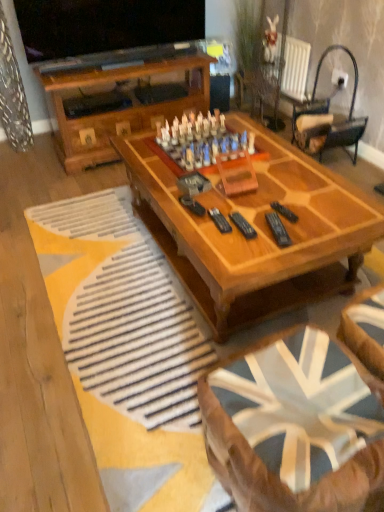
In order to face wooden coffee table at center, which is counted as the 1th coffee table, starting from the back, should I rotate leftwards or rightwards?

You should look right and rotate roughly 5.343 degrees.

Where is `wooden coffee table at center, the 1th coffee table from the top`? This screenshot has height=512, width=384. wooden coffee table at center, the 1th coffee table from the top is located at coordinates (259, 218).

What is the approximate height of black plastic remote at center, marked as the 1th remote in a left-to-right arrangement?

black plastic remote at center, marked as the 1th remote in a left-to-right arrangement, is 1.05 inches tall.

The height and width of the screenshot is (512, 384). What do you see at coordinates (278, 229) in the screenshot?
I see `black plastic remote at center, arranged as the second remote when viewed from the right` at bounding box center [278, 229].

You are a GUI agent. You are given a task and a screenshot of the screen. Output one action in this format:
    pyautogui.click(x=<x>, y=<y>)
    Task: Click on the black plastic remote at center, which is the 2th remote in left-to-right order
    
    Given the screenshot: What is the action you would take?
    pyautogui.click(x=278, y=229)

What are the coordinates of `wooden coffee table at center, which is counted as the second coffee table, starting from the back` in the screenshot? It's located at (278, 477).

Where is `wooden coffee table at center, the 1th coffee table from the top`? The height and width of the screenshot is (512, 384). wooden coffee table at center, the 1th coffee table from the top is located at coordinates (259, 218).

Considering the sizes of objects black plastic remote at center, which appears as the third remote when viewed from the right, and wooden coffee table at center, placed as the 2th coffee table when sorted from top to bottom, in the image provided, who is taller, black plastic remote at center, which appears as the third remote when viewed from the right, or wooden coffee table at center, placed as the 2th coffee table when sorted from top to bottom,?

With more height is wooden coffee table at center, placed as the 2th coffee table when sorted from top to bottom.

Is point (248, 236) in front of point (368, 345)?

That is False.

Between black plastic remote at center, which appears as the third remote when viewed from the right, and wooden coffee table at center, which is the first coffee table from front to back, which one has smaller width?

Thinner between the two is black plastic remote at center, which appears as the third remote when viewed from the right.

Measure the distance between black plastic remote at center, which appears as the third remote when viewed from the right, and wooden coffee table at center, which is the first coffee table from front to back.

The distance of black plastic remote at center, which appears as the third remote when viewed from the right, from wooden coffee table at center, which is the first coffee table from front to back, is 30.80 inches.

Can you tell me how much black plastic remote at center, positioned as the first remote in right-to-left order, and black metal/wooden rocking chair at upper right differ in facing direction?

85.9 degrees separate the facing orientations of black plastic remote at center, positioned as the first remote in right-to-left order, and black metal/wooden rocking chair at upper right.

Between black plastic remote at center, positioned as the first remote in right-to-left order, and black metal/wooden rocking chair at upper right, which one has larger width?

black metal/wooden rocking chair at upper right.

From a real-world perspective, which is physically below, black plastic remote at center, positioned as the first remote in right-to-left order, or black metal/wooden rocking chair at upper right?

black metal/wooden rocking chair at upper right is physically lower.

Does black plastic remote at center, positioned as the first remote in right-to-left order, have a greater height compared to black metal/wooden rocking chair at upper right?

In fact, black plastic remote at center, positioned as the first remote in right-to-left order, may be shorter than black metal/wooden rocking chair at upper right.

Consider the image. In the image, is black plastic remote at center, marked as the 1th remote in a left-to-right arrangement, on the left side or the right side of wooden chess set at center?

black plastic remote at center, marked as the 1th remote in a left-to-right arrangement, is positioned on wooden chess set at center's right side.

Considering the positions of objects black plastic remote at center, which appears as the third remote when viewed from the right, and wooden chess set at center in the image provided, who is in front, black plastic remote at center, which appears as the third remote when viewed from the right, or wooden chess set at center?

Positioned in front is black plastic remote at center, which appears as the third remote when viewed from the right.

Are black plastic remote at center, which appears as the third remote when viewed from the right, and wooden chess set at center far apart?

Actually, black plastic remote at center, which appears as the third remote when viewed from the right, and wooden chess set at center are a little close together.

Is black plastic remote at center, positioned as the first remote in right-to-left order, further to camera compared to wooden coffee table at center, which appears as the 2th coffee table when viewed from the front?

Yes, the depth of black plastic remote at center, positioned as the first remote in right-to-left order, is greater than that of wooden coffee table at center, which appears as the 2th coffee table when viewed from the front.

In terms of height, does black plastic remote at center, positioned as the first remote in right-to-left order, look taller or shorter compared to wooden coffee table at center, the 1th coffee table from the top?

In the image, black plastic remote at center, positioned as the first remote in right-to-left order, appears to be shorter than wooden coffee table at center, the 1th coffee table from the top.

Can you see black plastic remote at center, the 3th remote viewed from the left, touching wooden coffee table at center, which is counted as the 1th coffee table, starting from the back?

They are not placed beside each other.

Can you confirm if black plastic remote at center, the 3th remote viewed from the left, is bigger than wooden coffee table at center, the 1th coffee table from the top?

No, black plastic remote at center, the 3th remote viewed from the left, is not bigger than wooden coffee table at center, the 1th coffee table from the top.

Could you tell me if black plastic remote at center, marked as the 1th remote in a left-to-right arrangement, is facing black metal/wooden rocking chair at upper right?

No.

Is black plastic remote at center, which appears as the third remote when viewed from the right, in front of or behind black metal/wooden rocking chair at upper right in the image?

Visually, black plastic remote at center, which appears as the third remote when viewed from the right, is located in front of black metal/wooden rocking chair at upper right.

Can you tell me how much black plastic remote at center, which appears as the third remote when viewed from the right, and black metal/wooden rocking chair at upper right differ in facing direction?

93.6 degrees.

Between black plastic remote at center, which appears as the third remote when viewed from the right, and black metal/wooden rocking chair at upper right, which one appears on the right side from the viewer's perspective?

black metal/wooden rocking chair at upper right is more to the right.

Considering the points (282, 241) and (361, 454), which point is in front, point (282, 241) or point (361, 454)?

Point (361, 454)

From a real-world perspective, relative to wooden coffee table at center, placed as the 2th coffee table when sorted from top to bottom, is black plastic remote at center, arranged as the second remote when viewed from the right, vertically above or below?

In terms of real-world spatial position, black plastic remote at center, arranged as the second remote when viewed from the right, is above wooden coffee table at center, placed as the 2th coffee table when sorted from top to bottom.

Does black plastic remote at center, which is the 2th remote in left-to-right order, lie behind wooden coffee table at center, placed as the 2th coffee table when sorted from top to bottom?

Yes, black plastic remote at center, which is the 2th remote in left-to-right order, is further from the viewer.

From the image's perspective, count 1st remotes downward from the black plastic remote at center, the 3th remote viewed from the left, and point to it. Please provide its 2D coordinates.

[(243, 225)]

Between black plastic remote at center, which appears as the third remote when viewed from the right, and black plastic remote at center, the 3th remote viewed from the left, which one has more height?

black plastic remote at center, which appears as the third remote when viewed from the right, is taller.

Is black plastic remote at center, which appears as the third remote when viewed from the right, with black plastic remote at center, the 3th remote viewed from the left?

There is a gap between black plastic remote at center, which appears as the third remote when viewed from the right, and black plastic remote at center, the 3th remote viewed from the left.

Is black plastic remote at center, marked as the 1th remote in a left-to-right arrangement, smaller than black plastic remote at center, the 3th remote viewed from the left?

Actually, black plastic remote at center, marked as the 1th remote in a left-to-right arrangement, might be larger than black plastic remote at center, the 3th remote viewed from the left.

Find the location of `the 2nd remote above when counting from the wooden coffee table at center, which is counted as the second coffee table, starting from the back (from the image's perspective)`. the 2nd remote above when counting from the wooden coffee table at center, which is counted as the second coffee table, starting from the back (from the image's perspective) is located at coordinates (243, 225).

The height and width of the screenshot is (512, 384). I want to click on rocking chair below the black plastic remote at center, the 3th remote viewed from the left (from a real-world perspective), so click(327, 119).

Considering their positions, is black plastic remote at center, which appears as the third remote when viewed from the right, positioned closer to black metal/wooden rocking chair at upper right than wooden chess set at center?

wooden chess set at center is closer to black metal/wooden rocking chair at upper right.

From the image, which object appears to be nearer to wooden coffee table at center, placed as the 2th coffee table when sorted from top to bottom, black plastic remote at center, arranged as the second remote when viewed from the right, or wooden chess set at center?

The object closer to wooden coffee table at center, placed as the 2th coffee table when sorted from top to bottom, is black plastic remote at center, arranged as the second remote when viewed from the right.

Based on their spatial positions, is wooden coffee table at center, placed as the 2th coffee table when sorted from top to bottom, or black plastic remote at center, positioned as the first remote in right-to-left order, closer to wooden chess set at center?

black plastic remote at center, positioned as the first remote in right-to-left order, lies closer to wooden chess set at center than the other object.

Estimate the real-world distances between objects in this image. Which object is further from wooden coffee table at center, arranged as the 2th coffee table when ordered from the bottom, black metal/wooden rocking chair at upper right or black plastic remote at center, arranged as the second remote when viewed from the right?

Among the two, black metal/wooden rocking chair at upper right is located further to wooden coffee table at center, arranged as the 2th coffee table when ordered from the bottom.

Estimate the real-world distances between objects in this image. Which object is further from wooden chess set at center, black plastic remote at center, which is the 2th remote in left-to-right order, or black plastic remote at center, the 3th remote viewed from the left?

black plastic remote at center, which is the 2th remote in left-to-right order.

Which object lies nearer to the anchor point wooden coffee table at center, the 1th coffee table from the top, wooden coffee table at center, which is counted as the second coffee table, starting from the back, or black plastic remote at center, marked as the 1th remote in a left-to-right arrangement?

black plastic remote at center, marked as the 1th remote in a left-to-right arrangement.

Estimate the real-world distances between objects in this image. Which object is closer to wooden chess set at center, black plastic remote at center, which appears as the third remote when viewed from the right, or black plastic remote at center, arranged as the second remote when viewed from the right?

The object closer to wooden chess set at center is black plastic remote at center, which appears as the third remote when viewed from the right.

Which object lies further to the anchor point wooden chess set at center, black plastic remote at center, marked as the 1th remote in a left-to-right arrangement, or black metal/wooden rocking chair at upper right?

black metal/wooden rocking chair at upper right.

Find the location of a particular element. remote between black metal/wooden rocking chair at upper right and black plastic remote at center, which appears as the third remote when viewed from the right, from top to bottom is located at coordinates (284, 212).

The height and width of the screenshot is (512, 384). In order to click on remote positioned between wooden coffee table at center, arranged as the 2th coffee table when ordered from the bottom, and black plastic remote at center, which appears as the third remote when viewed from the right, from near to far in this screenshot , I will do pos(278,229).

Identify the location of coffee table between wooden chess set at center and wooden coffee table at center, which is the first coffee table from front to back, in the vertical direction. (259, 218).

Find the location of a particular element. The image size is (384, 512). game located between wooden coffee table at center, the 1th coffee table from the top, and black metal/wooden rocking chair at upper right in the depth direction is located at coordinates (202, 141).